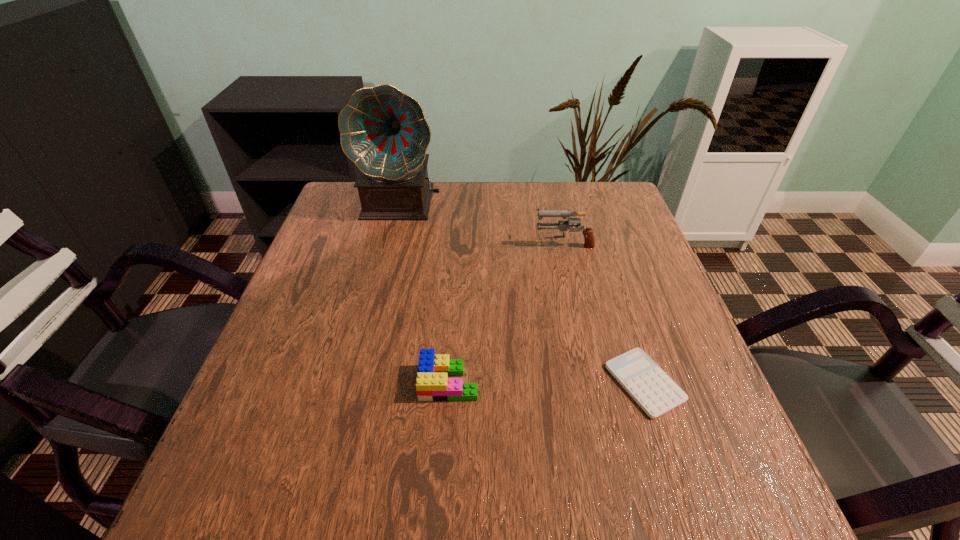
In the image, there is a desktop. Identify the location of vacant space at the left edge. (351, 237).

Locate an element on the screen. The width and height of the screenshot is (960, 540). free point at the right edge is located at coordinates (604, 246).

The image size is (960, 540). In the image, there is a desktop. Identify the location of vacant space at the far left corner. (359, 205).

In the image, there is a desktop. In order to click on vacant area at the far right corner in this screenshot , I will do `click(614, 187)`.

Locate an element on the screen. The width and height of the screenshot is (960, 540). vacant space in between the record player and the third tallest object is located at coordinates (425, 293).

The image size is (960, 540). In order to click on vacant area that lies between the Lego and the leftmost object in this screenshot , I will do `click(425, 293)`.

Where is `unoccupied position between the record player and the calculator`? This screenshot has height=540, width=960. unoccupied position between the record player and the calculator is located at coordinates (523, 293).

At what (x,y) coordinates should I click in order to perform the action: click on vacant space that's between the shortest object and the Lego. Please return your answer as a coordinate pair (x, y). Looking at the image, I should click on (546, 382).

Identify the location of free point between the calculator and the second shortest object. (546, 382).

Identify the location of free point between the second shortest object and the third nearest object. (506, 313).